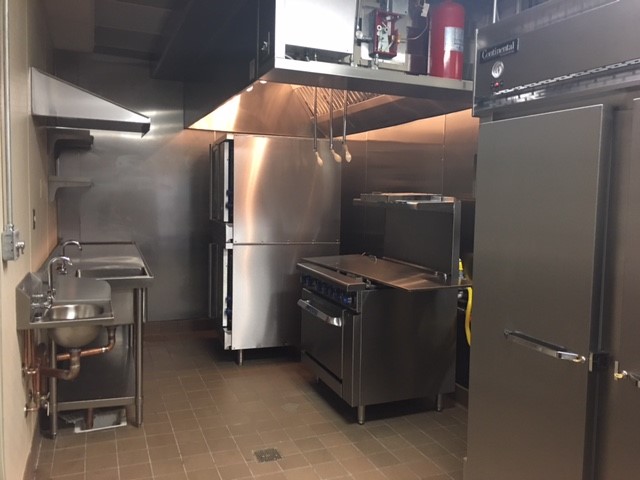
This screenshot has width=640, height=480. Identify the location of wall. (16, 188), (157, 196), (440, 166).